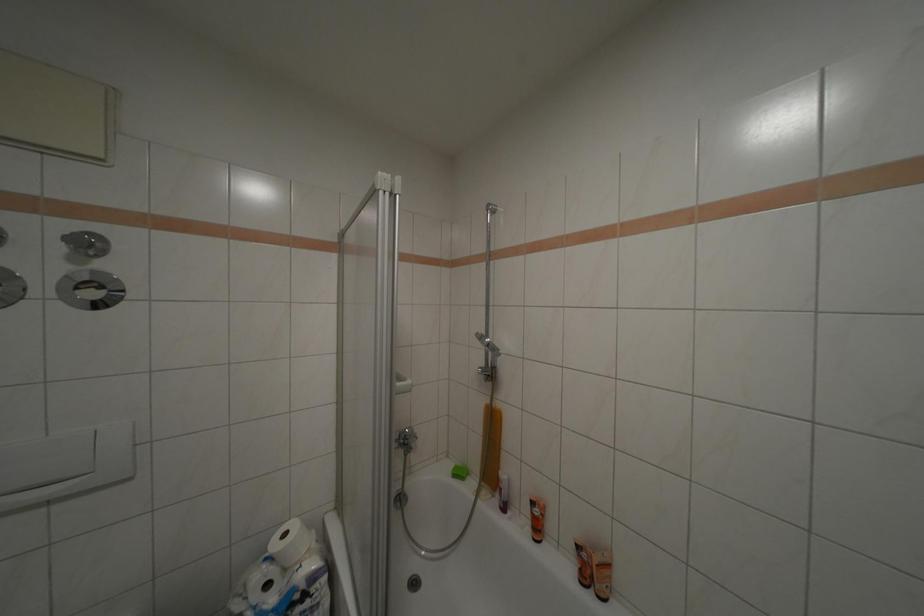
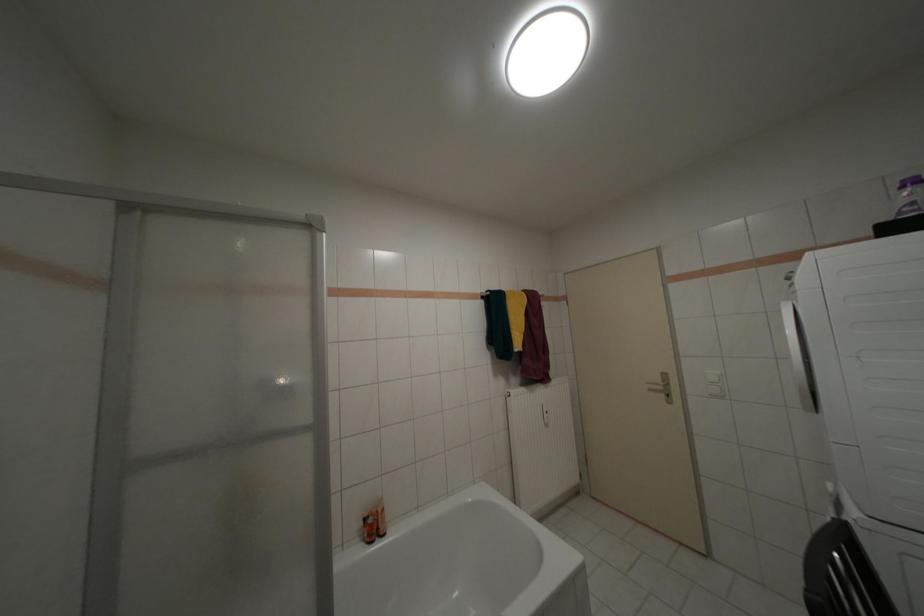
Question: The camera is either moving clockwise (left) or counter-clockwise (right) around the object. The first image is from the beginning of the video and the second image is from the end. Is the camera moving left or right when shooting the video?

Choices:
 (A) Left
 (B) Right

Answer: (A)